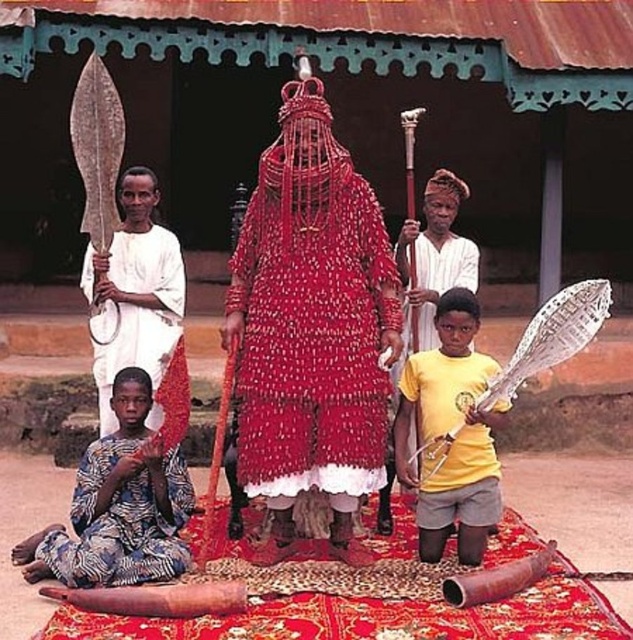
Question: Observing the image, what is the correct spatial positioning of red beaded robe at center in reference to white clothed spear at left?

Choices:
 (A) below
 (B) above

Answer: (A)

Question: Which of the following is the closest to the observer?

Choices:
 (A) (168, 330)
 (B) (498, 480)
 (C) (380, 396)
 (D) (408, 355)

Answer: (C)

Question: Which of these objects is positioned closest to the red beaded robe at center?

Choices:
 (A) yellow matte shirt at center
 (B) white clothed man at center
 (C) printed fabric child at lower left
 (D) white clothed spear at left

Answer: (A)

Question: Does printed fabric child at lower left have a larger size compared to white clothed man at center?

Choices:
 (A) no
 (B) yes

Answer: (B)

Question: Which point is farther to the camera?

Choices:
 (A) (142, 360)
 (B) (139, 484)
 (C) (266, 376)
 (D) (489, 417)

Answer: (A)

Question: Does printed fabric child at lower left appear under yellow matte shirt at center?

Choices:
 (A) no
 (B) yes

Answer: (B)